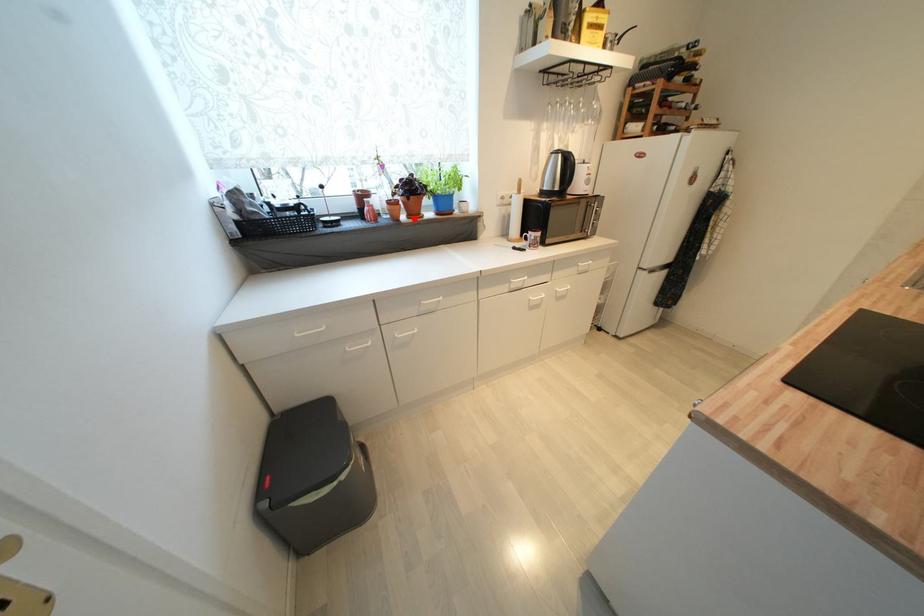
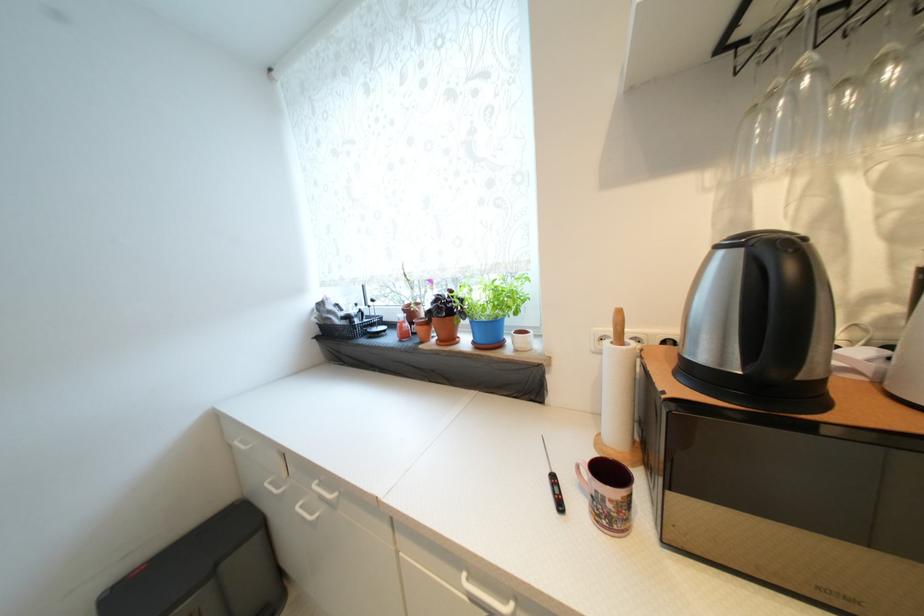
Locate, in the second image, the point that corresponds to the highlighted location in the first image.

(445, 342)